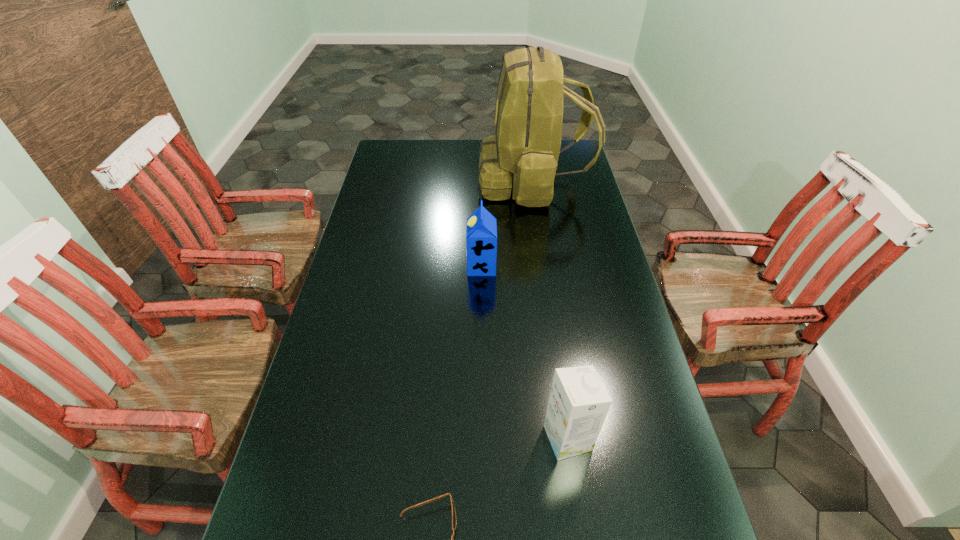
Where is `the closest object to the left carton`? the closest object to the left carton is located at coordinates (523, 155).

I want to click on free location that satisfies the following two spatial constraints: 1. with the cap open on the nearer carton; 2. on the right side of the second farthest object, so click(x=482, y=438).